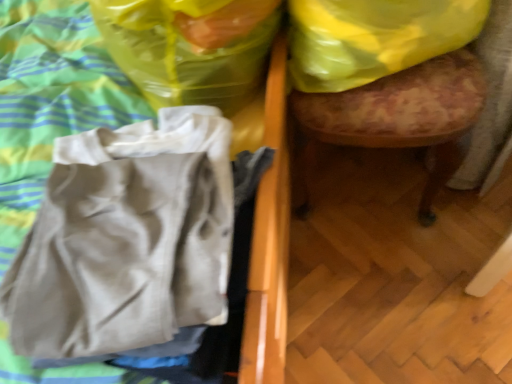
Question: Is wooden upholstered stool at right positioned beyond the bounds of beige cotton shirt at left?

Choices:
 (A) no
 (B) yes

Answer: (B)

Question: From the image's perspective, is wooden upholstered stool at right on beige cotton shirt at left?

Choices:
 (A) no
 (B) yes

Answer: (B)

Question: Is the depth of wooden upholstered stool at right greater than that of beige cotton shirt at left?

Choices:
 (A) yes
 (B) no

Answer: (A)

Question: Is wooden upholstered stool at right positioned far away from beige cotton shirt at left?

Choices:
 (A) no
 (B) yes

Answer: (A)

Question: Is wooden upholstered stool at right next to beige cotton shirt at left?

Choices:
 (A) no
 (B) yes

Answer: (A)

Question: Considering the relative sizes of wooden upholstered stool at right and beige cotton shirt at left in the image provided, is wooden upholstered stool at right smaller than beige cotton shirt at left?

Choices:
 (A) yes
 (B) no

Answer: (B)

Question: Is yellow plastic bag at upper right, the 1th plastic bag viewed from the right, positioned far away from wooden upholstered stool at right?

Choices:
 (A) no
 (B) yes

Answer: (A)

Question: From a real-world perspective, does yellow plastic bag at upper right, the 1th plastic bag viewed from the right, stand above wooden upholstered stool at right?

Choices:
 (A) yes
 (B) no

Answer: (A)

Question: Does yellow plastic bag at upper right, the 1th plastic bag viewed from the right, have a greater width compared to wooden upholstered stool at right?

Choices:
 (A) yes
 (B) no

Answer: (B)

Question: From the image's perspective, is yellow plastic bag at upper right, the 1th plastic bag viewed from the right, below wooden upholstered stool at right?

Choices:
 (A) yes
 (B) no

Answer: (B)

Question: From the image's perspective, would you say yellow plastic bag at upper right, the 1th plastic bag viewed from the right, is positioned over wooden upholstered stool at right?

Choices:
 (A) yes
 (B) no

Answer: (A)

Question: Does yellow plastic bag at upper right, the 1th plastic bag viewed from the right, come behind wooden upholstered stool at right?

Choices:
 (A) yes
 (B) no

Answer: (A)

Question: Does wooden upholstered stool at right have a lesser width compared to yellow plastic bag at upper right, the 2th plastic bag from the left?

Choices:
 (A) no
 (B) yes

Answer: (A)